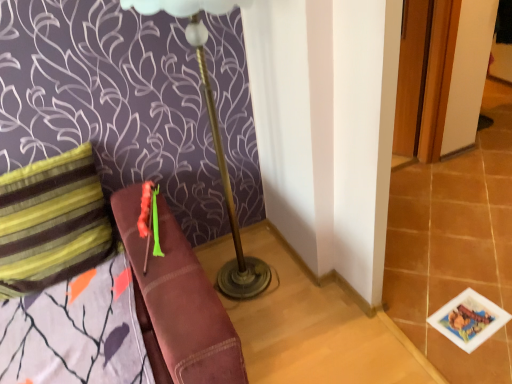
Question: Considering the relative sizes of printed paper card at lower right and metallic gold table lamp at center in the image provided, is printed paper card at lower right thinner than metallic gold table lamp at center?

Choices:
 (A) yes
 (B) no

Answer: (A)

Question: Is printed paper card at lower right positioned with its back to metallic gold table lamp at center?

Choices:
 (A) no
 (B) yes

Answer: (A)

Question: Is printed paper card at lower right at the left side of metallic gold table lamp at center?

Choices:
 (A) no
 (B) yes

Answer: (A)

Question: From the image's perspective, is printed paper card at lower right beneath metallic gold table lamp at center?

Choices:
 (A) no
 (B) yes

Answer: (B)

Question: From a real-world perspective, does printed paper card at lower right sit lower than metallic gold table lamp at center?

Choices:
 (A) no
 (B) yes

Answer: (B)

Question: Is printed paper card at lower right aimed at metallic gold table lamp at center?

Choices:
 (A) no
 (B) yes

Answer: (A)

Question: From a real-world perspective, is metallic gold table lamp at center located higher than striped fabric pillow at left?

Choices:
 (A) yes
 (B) no

Answer: (A)

Question: Is metallic gold table lamp at center at the left side of striped fabric pillow at left?

Choices:
 (A) yes
 (B) no

Answer: (B)

Question: From the image's perspective, does metallic gold table lamp at center appear higher than striped fabric pillow at left?

Choices:
 (A) yes
 (B) no

Answer: (A)

Question: Is striped fabric pillow at left a part of metallic gold table lamp at center?

Choices:
 (A) yes
 (B) no

Answer: (B)

Question: Can you confirm if metallic gold table lamp at center is wider than striped fabric pillow at left?

Choices:
 (A) yes
 (B) no

Answer: (A)

Question: Is metallic gold table lamp at center looking in the opposite direction of striped fabric pillow at left?

Choices:
 (A) yes
 (B) no

Answer: (B)

Question: Is striped fabric pillow at left positioned in front of metallic gold table lamp at center?

Choices:
 (A) no
 (B) yes

Answer: (A)